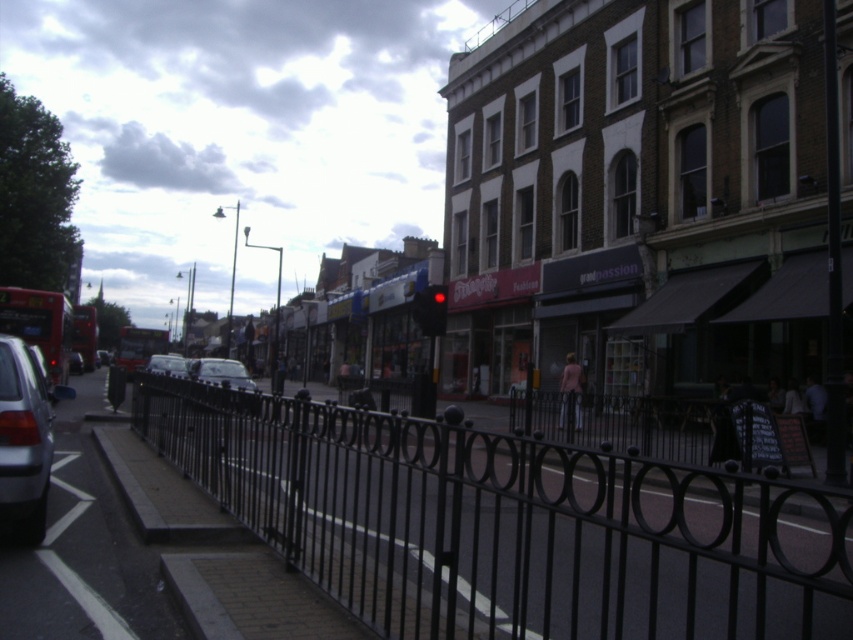
This screenshot has height=640, width=853. I want to click on smooth concrete pavement at lower left, so click(83, 550).

The height and width of the screenshot is (640, 853). What do you see at coordinates (83, 550) in the screenshot?
I see `smooth concrete pavement at lower left` at bounding box center [83, 550].

Between point (45, 534) and point (183, 364), which one is positioned behind?

The point (183, 364) is behind.

Where is `smooth concrete pavement at lower left`? Image resolution: width=853 pixels, height=640 pixels. smooth concrete pavement at lower left is located at coordinates (83, 550).

Can you confirm if red metallic bus at left is shorter than metallic silver car at center?

No, red metallic bus at left is not shorter than metallic silver car at center.

Who is positioned more to the left, red metallic bus at left or metallic silver car at center?

From the viewer's perspective, metallic silver car at center appears more on the left side.

What do you see at coordinates (39, 324) in the screenshot? This screenshot has width=853, height=640. I see `red metallic bus at left` at bounding box center [39, 324].

Image resolution: width=853 pixels, height=640 pixels. Identify the location of red metallic bus at left. (39, 324).

Between smooth concrete pavement at lower left and red metallic bus at left, which one appears on the right side from the viewer's perspective?

smooth concrete pavement at lower left is more to the right.

Locate an element on the screen. The height and width of the screenshot is (640, 853). smooth concrete pavement at lower left is located at coordinates (83, 550).